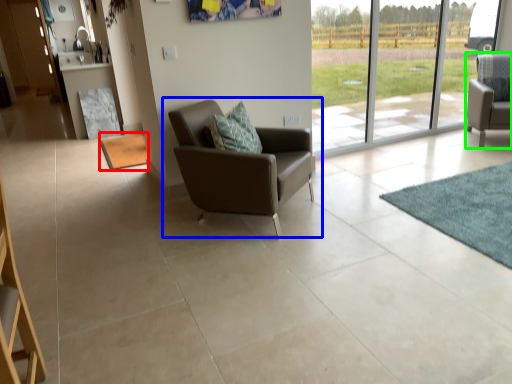
Question: Which object is the farthest from mat (highlighted by a red box)? Choose among these: chair (highlighted by a blue box) or chair (highlighted by a green box).

Choices:
 (A) chair
 (B) chair

Answer: (B)